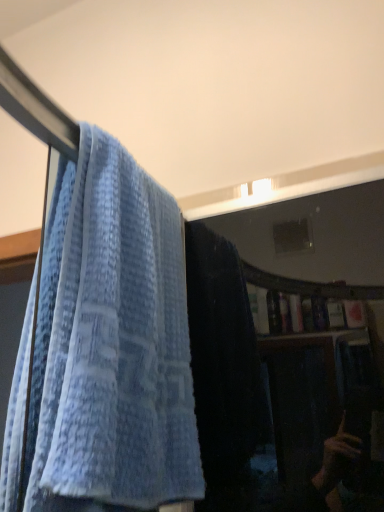
You are a GUI agent. You are given a task and a screenshot of the screen. Output one action in this format:
    pyautogui.click(x=<x>, y=<y>)
    Task: Click on the blue textured towel at left
    
    Given the screenshot: What is the action you would take?
    pyautogui.click(x=114, y=344)

Describe the element at coordinates (114, 344) in the screenshot. This screenshot has height=512, width=384. I see `blue textured towel at left` at that location.

Locate an element on the screen. blue textured towel at left is located at coordinates (114, 344).